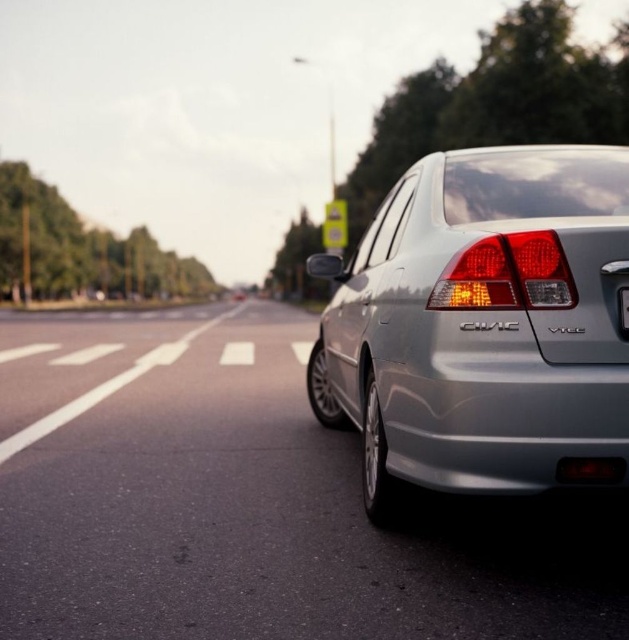
You are a car designer evaluating the rear design of the silver Honda Civic. Based on the image, which object is wider between the matte plastic brake light at rear and the black plastic license plate at rear?

The matte plastic brake light at rear might be wider than the black plastic license plate at rear according to the description.

You are a driver approaching the road and need to determine the distance between two points on the road ahead. The points are labeled as point (487, 490) and point (518, 307). Based on the scene, which point is closer to you?

Point (518, 307) is closer to you because it is less further to the camera than point (487, 490).